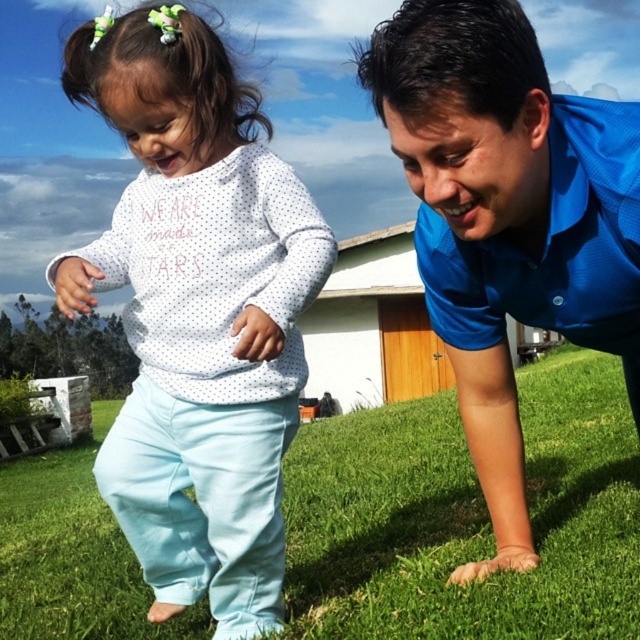
Question: In this image, where is green grass at lower center located relative to blue smooth shirt at center?

Choices:
 (A) above
 (B) below

Answer: (B)

Question: Is the position of white dotted sweater at center more distant than that of blue smooth shirt at center?

Choices:
 (A) yes
 (B) no

Answer: (A)

Question: Which of the following is the closest to the observer?

Choices:
 (A) (413, 140)
 (B) (109, 524)
 (C) (141, 140)

Answer: (A)

Question: Which object appears farthest from the camera in this image?

Choices:
 (A) green grass at lower center
 (B) blue smooth shirt at center
 (C) white dotted sweater at center

Answer: (A)

Question: Among these points, which one is farthest from the camera?

Choices:
 (A) (113, 513)
 (B) (616, 262)

Answer: (A)

Question: Is white dotted sweater at center thinner than blue smooth shirt at center?

Choices:
 (A) no
 (B) yes

Answer: (A)